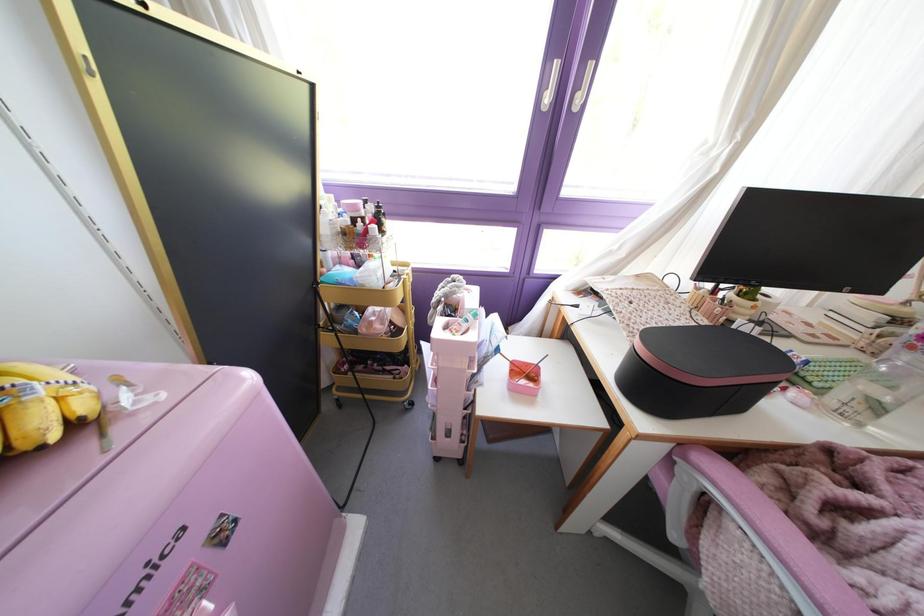
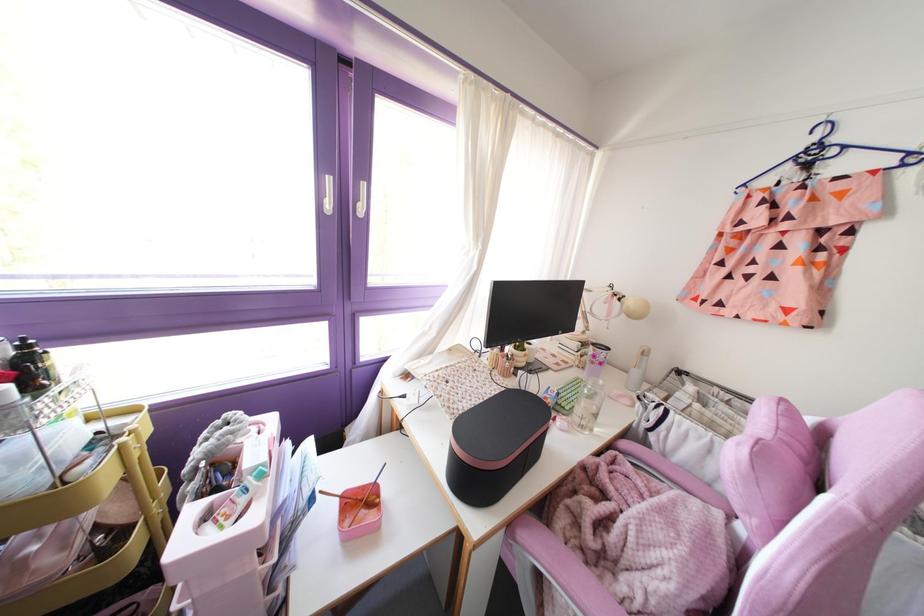
Locate, in the second image, the point that corresponds to (x=524, y=363) in the first image.

(359, 487)